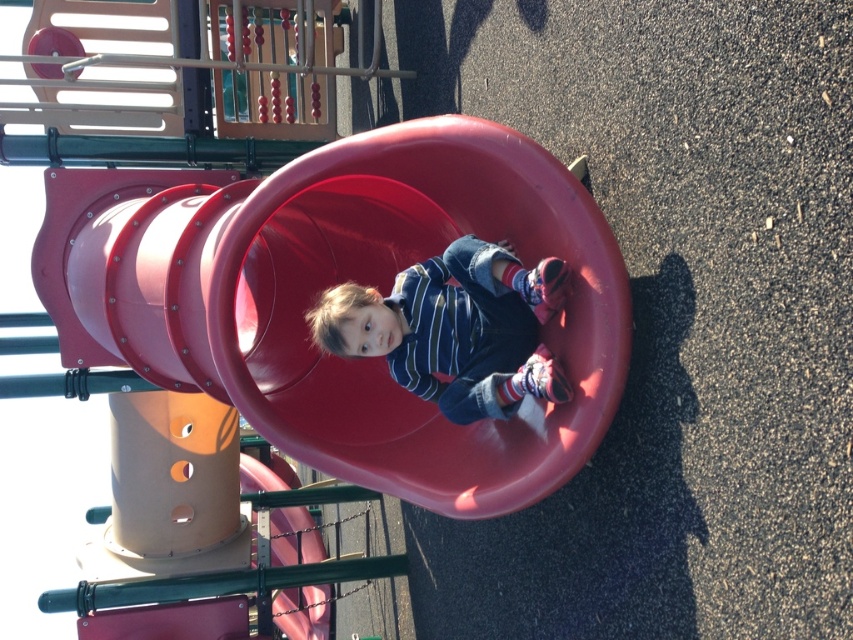
Question: Among these objects, which one is farthest from the camera?

Choices:
 (A) smooth plastic slide at center
 (B) striped cotton shirt at center

Answer: (B)

Question: Is smooth plastic slide at center smaller than striped cotton shirt at center?

Choices:
 (A) no
 (B) yes

Answer: (A)

Question: From the image, what is the correct spatial relationship of smooth plastic slide at center in relation to striped cotton shirt at center?

Choices:
 (A) left
 (B) right

Answer: (A)

Question: Can you confirm if smooth plastic slide at center is positioned below striped cotton shirt at center?

Choices:
 (A) no
 (B) yes

Answer: (A)